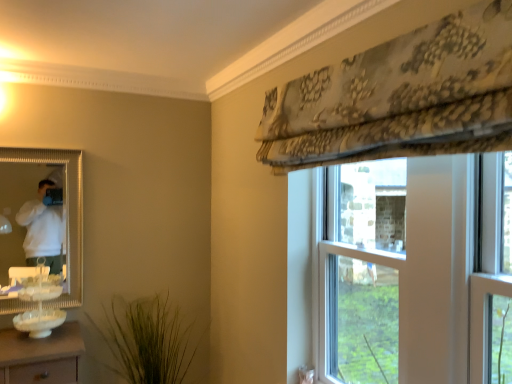
Measure the distance between green grass-like plant at lower center and camera.

green grass-like plant at lower center and camera are 2.39 meters apart.

In order to click on white glassware at lower left in this screenshot , I will do `click(40, 305)`.

This screenshot has height=384, width=512. What do you see at coordinates (30, 221) in the screenshot?
I see `gold-framed mirror at left` at bounding box center [30, 221].

Identify the location of clear glass window at center. This screenshot has width=512, height=384. (362, 272).

From the image's perspective, is gold-framed mirror at left over white glassware at lower left?

Yes.

Looking at this image, can you tell me how much gold-framed mirror at left and white glassware at lower left differ in facing direction?

2.38 degrees separate the facing orientations of gold-framed mirror at left and white glassware at lower left.

Between gold-framed mirror at left and white glassware at lower left, which one appears on the right side from the viewer's perspective?

white glassware at lower left is more to the right.

From a real-world perspective, which is physically above, gold-framed mirror at left or white glassware at lower left?

In real-world perspective, gold-framed mirror at left is above.

Consider the image. Which is more to the right, white glassware at lower left or green grass-like plant at lower center?

From the viewer's perspective, green grass-like plant at lower center appears more on the right side.

From the image's perspective, is white glassware at lower left located beneath green grass-like plant at lower center?

No, from the image's perspective, white glassware at lower left is not below green grass-like plant at lower center.

Choose the correct answer: Is white glassware at lower left inside green grass-like plant at lower center or outside it?

white glassware at lower left is outside green grass-like plant at lower center.

Based on the photo, would you say gold-framed mirror at left is to the left or to the right of green grass-like plant at lower center in the picture?

gold-framed mirror at left is to the left of green grass-like plant at lower center.

From the image's perspective, which is above, gold-framed mirror at left or green grass-like plant at lower center?

From the image's view, gold-framed mirror at left is above.

Is gold-framed mirror at left thinner than green grass-like plant at lower center?

Correct, the width of gold-framed mirror at left is less than that of green grass-like plant at lower center.

Which is less distant, (x=53, y=245) or (x=173, y=309)?

Point (x=53, y=245) is positioned closer to the camera compared to point (x=173, y=309).

I want to click on bay window located above the white glassware at lower left (from a real-world perspective), so click(362, 272).

Between clear glass window at center and white glassware at lower left, which one appears on the right side from the viewer's perspective?

clear glass window at center.

In terms of height, does clear glass window at center look taller or shorter compared to white glassware at lower left?

clear glass window at center is taller than white glassware at lower left.

Considering the positions of point (348, 169) and point (54, 315), is point (348, 169) closer or farther from the camera than point (54, 315)?

Point (348, 169) is positioned closer to the camera compared to point (54, 315).

Between white glassware at lower left and gold-framed mirror at left, which one has more height?

With more height is gold-framed mirror at left.

From the image's perspective, does white glassware at lower left appear lower than gold-framed mirror at left?

Yes, from the image's perspective, white glassware at lower left is beneath gold-framed mirror at left.

Which is closer, [48,321] or [60,256]?

Positioned in front is point [48,321].

Are green grass-like plant at lower center and clear glass window at center far apart?

Yes, green grass-like plant at lower center and clear glass window at center are quite far apart.

Can you confirm if green grass-like plant at lower center is shorter than clear glass window at center?

Indeed, green grass-like plant at lower center has a lesser height compared to clear glass window at center.

Is green grass-like plant at lower center facing towards clear glass window at center?

Yes, green grass-like plant at lower center is oriented towards clear glass window at center.

Between point (169, 374) and point (53, 327), which one is positioned behind?

The point (169, 374) is more distant.

Is green grass-like plant at lower center situated inside white glassware at lower left or outside?

green grass-like plant at lower center exists outside the volume of white glassware at lower left.

Between green grass-like plant at lower center and white glassware at lower left, which one appears on the right side from the viewer's perspective?

Positioned to the right is green grass-like plant at lower center.

Where is `mirror that is above the white glassware at lower left (from the image's perspective)`? Image resolution: width=512 pixels, height=384 pixels. mirror that is above the white glassware at lower left (from the image's perspective) is located at coordinates (30, 221).

Find the location of `sink above the green grass-like plant at lower center (from a real-world perspective)`. sink above the green grass-like plant at lower center (from a real-world perspective) is located at coordinates (40, 305).

From the picture: Which object lies further to the anchor point green grass-like plant at lower center, clear glass window at center or gold-framed mirror at left?

clear glass window at center.

Based on their spatial positions, is clear glass window at center or green grass-like plant at lower center further from white glassware at lower left?

Among the two, clear glass window at center is located further to white glassware at lower left.

Looking at this image, estimate the real-world distances between objects in this image. Which object is closer to white glassware at lower left, gold-framed mirror at left or green grass-like plant at lower center?

Based on the image, gold-framed mirror at left appears to be nearer to white glassware at lower left.

Considering their positions, is clear glass window at center positioned closer to green grass-like plant at lower center than white glassware at lower left?

The object closer to green grass-like plant at lower center is white glassware at lower left.

Based on their spatial positions, is clear glass window at center or white glassware at lower left closer to gold-framed mirror at left?

The object closer to gold-framed mirror at left is white glassware at lower left.

Considering their positions, is green grass-like plant at lower center positioned further to clear glass window at center than white glassware at lower left?

Among the two, white glassware at lower left is located further to clear glass window at center.

From the image, which object appears to be nearer to gold-framed mirror at left, white glassware at lower left or clear glass window at center?

Based on the image, white glassware at lower left appears to be nearer to gold-framed mirror at left.

Estimate the real-world distances between objects in this image. Which object is further from green grass-like plant at lower center, gold-framed mirror at left or clear glass window at center?

clear glass window at center lies further to green grass-like plant at lower center than the other object.

What are the coordinates of `sink between gold-framed mirror at left and green grass-like plant at lower center` in the screenshot? It's located at (40, 305).

Locate an element on the screen. The image size is (512, 384). houseplant between white glassware at lower left and clear glass window at center in the horizontal direction is located at coordinates (145, 340).

At what (x,y) coordinates should I click in order to perform the action: click on sink between gold-framed mirror at left and clear glass window at center in the horizontal direction. Please return your answer as a coordinate pair (x, y). Looking at the image, I should click on (40, 305).

Locate an element on the screen. houseplant situated between gold-framed mirror at left and clear glass window at center from left to right is located at coordinates (145, 340).